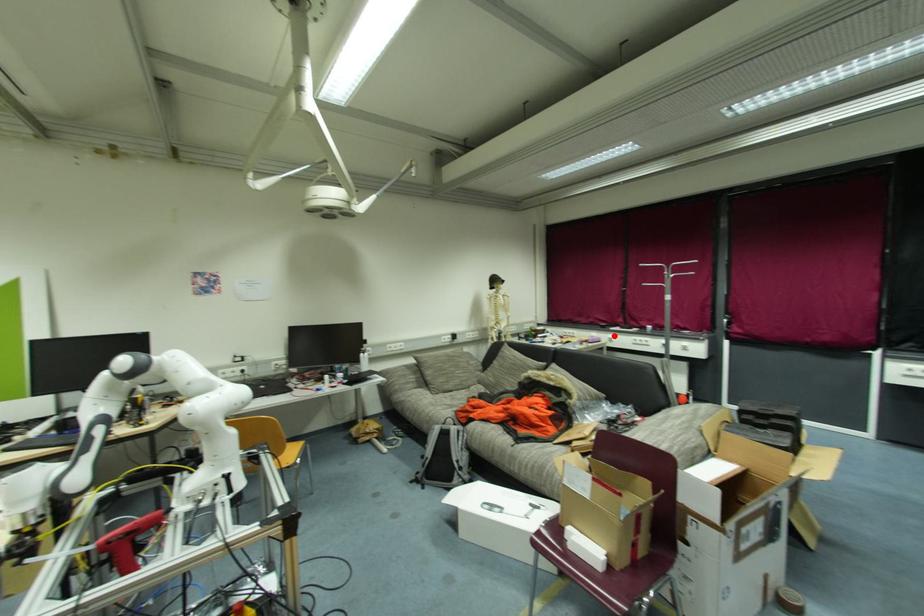
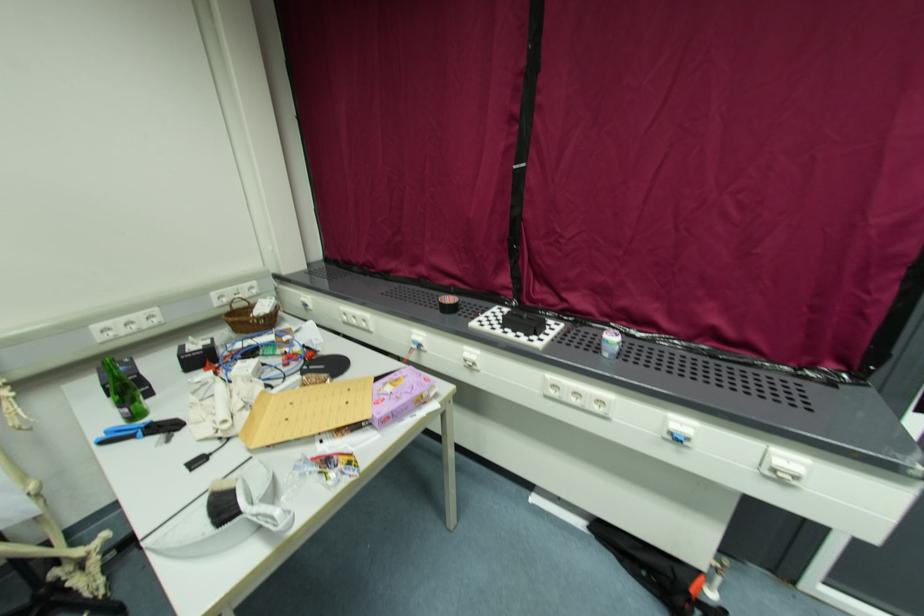
Where in the second image is the point corresponding to the highlighted location from the first image?

(476, 352)